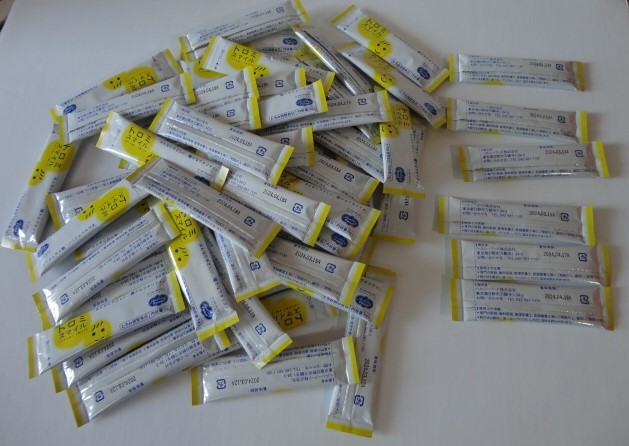
The height and width of the screenshot is (446, 629). In order to click on product laid orderly on table in this screenshot , I will do coord(550,301), coord(548,250), coord(538,211), coord(552,160), coord(555,125), coord(554,74).